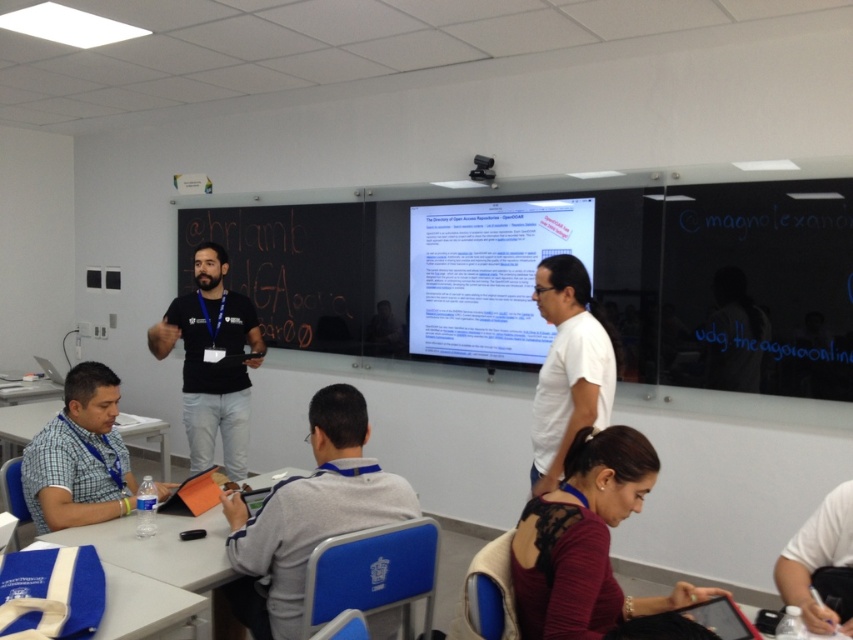
Can you confirm if white paper at center is wider than black lace top at lower center?

Indeed, white paper at center has a greater width compared to black lace top at lower center.

Does white paper at center have a larger size compared to black lace top at lower center?

Indeed, white paper at center has a larger size compared to black lace top at lower center.

Image resolution: width=853 pixels, height=640 pixels. In order to click on white paper at center in this screenshot , I will do `click(488, 275)`.

This screenshot has width=853, height=640. I want to click on white paper at center, so click(x=488, y=275).

Which is more to the right, black lace top at lower center or white matte shirt at center?

white matte shirt at center

Is black lace top at lower center above white matte shirt at center?

Incorrect, black lace top at lower center is not positioned above white matte shirt at center.

The height and width of the screenshot is (640, 853). What do you see at coordinates (585, 541) in the screenshot? I see `black lace top at lower center` at bounding box center [585, 541].

This screenshot has width=853, height=640. Identify the location of black lace top at lower center. (585, 541).

Which is behind, point (195, 563) or point (160, 451)?

Point (160, 451)

Where is `white plastic table at center`? white plastic table at center is located at coordinates (160, 548).